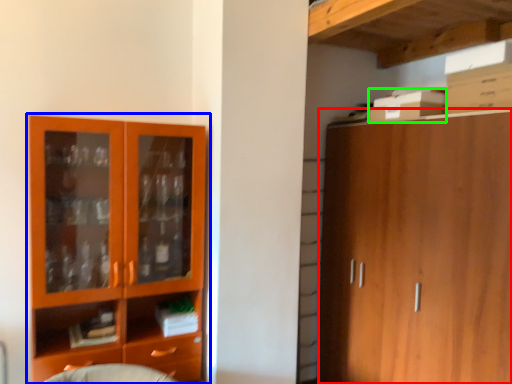
Question: Which is farther away from cabinetry (highlighted by a red box)? cupboard (highlighted by a blue box) or cardboard box (highlighted by a green box)?

Choices:
 (A) cupboard
 (B) cardboard box

Answer: (A)